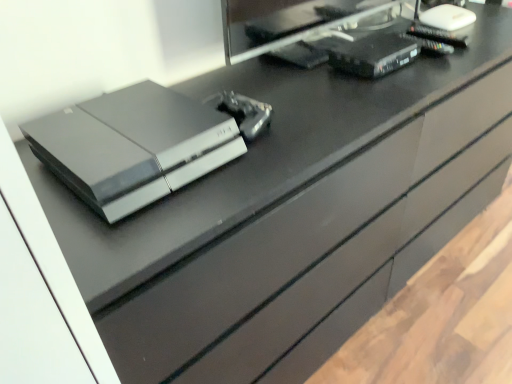
Question: Is black plastic desktop computer at upper right at the right side of satin black console at center?

Choices:
 (A) no
 (B) yes

Answer: (B)

Question: Is black plastic desktop computer at upper right surrounding satin black console at center?

Choices:
 (A) yes
 (B) no

Answer: (B)

Question: Does black plastic desktop computer at upper right have a greater height compared to satin black console at center?

Choices:
 (A) no
 (B) yes

Answer: (B)

Question: Is black plastic desktop computer at upper right positioned in front of satin black console at center?

Choices:
 (A) no
 (B) yes

Answer: (A)

Question: Is black plastic desktop computer at upper right next to satin black console at center?

Choices:
 (A) no
 (B) yes

Answer: (A)

Question: Is black plastic desktop computer at upper right positioned behind satin black console at center?

Choices:
 (A) no
 (B) yes

Answer: (B)

Question: Considering the relative sizes of black plastic desktop computer at upper right and black plastic router at upper right, the first equipment viewed from the right, in the image provided, is black plastic desktop computer at upper right smaller than black plastic router at upper right, the first equipment viewed from the right,?

Choices:
 (A) yes
 (B) no

Answer: (B)

Question: Does black plastic desktop computer at upper right have a greater width compared to black plastic router at upper right, the first equipment viewed from the right?

Choices:
 (A) yes
 (B) no

Answer: (B)

Question: Is black plastic desktop computer at upper right in contact with black plastic router at upper right, which ranks as the 2th equipment in left-to-right order?

Choices:
 (A) yes
 (B) no

Answer: (B)

Question: Does black plastic desktop computer at upper right turn towards black plastic router at upper right, the first equipment viewed from the right?

Choices:
 (A) yes
 (B) no

Answer: (A)

Question: Is black plastic desktop computer at upper right at the left side of black plastic router at upper right, positioned as the 1th equipment in back-to-front order?

Choices:
 (A) yes
 (B) no

Answer: (A)

Question: From the image's perspective, is black plastic desktop computer at upper right under black plastic router at upper right, which ranks as the second equipment in front-to-back order?

Choices:
 (A) yes
 (B) no

Answer: (B)

Question: From a real-world perspective, does black plastic desktop computer at upper right stand above metallic silver controller at center, the 2th equipment when ordered from top to bottom?

Choices:
 (A) yes
 (B) no

Answer: (A)